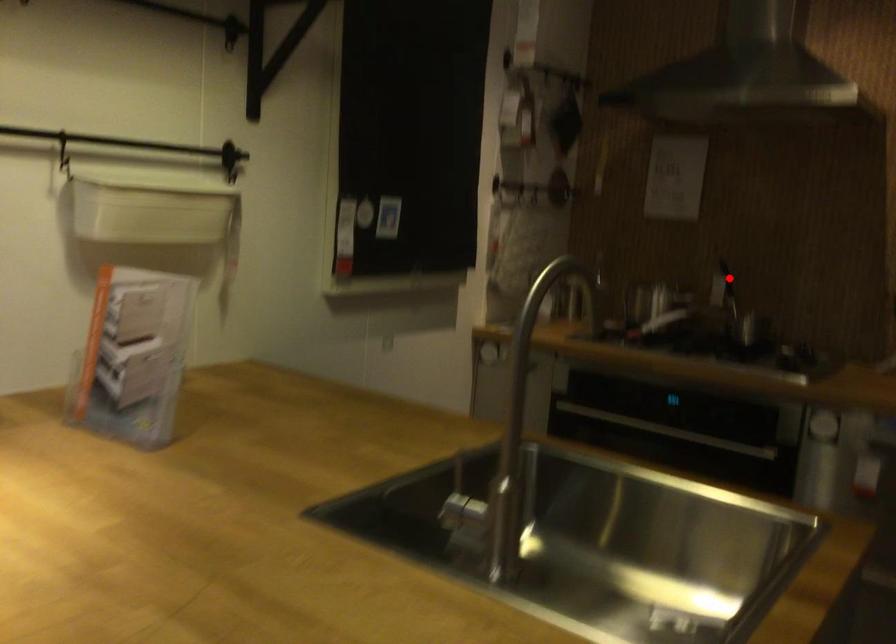
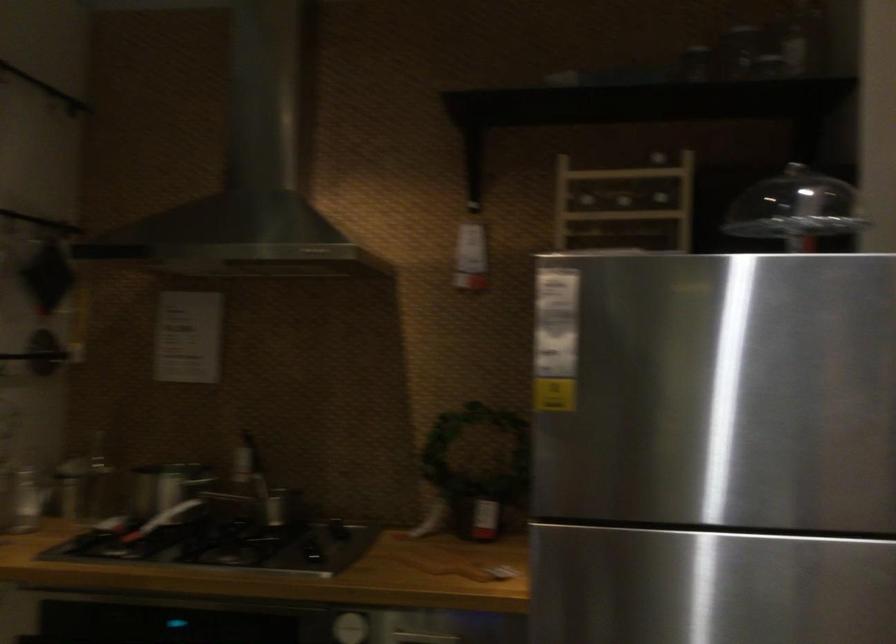
Where in the second image is the point corresponding to the highlighted location from the first image?

(243, 459)